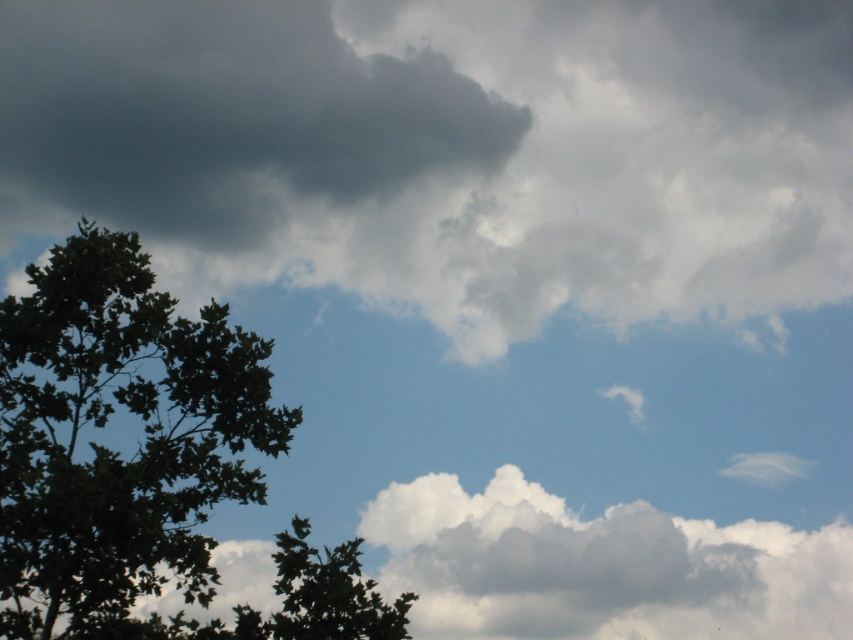
Is dark gray fluffy cloud at upper left closer to camera compared to white fluffy cloud at center?

No, dark gray fluffy cloud at upper left is behind white fluffy cloud at center.

Between dark gray fluffy cloud at upper left and white fluffy cloud at center, which one has less height?

With less height is white fluffy cloud at center.

Does point (621, 83) come farther from viewer compared to point (548, 525)?

Yes, point (621, 83) is behind point (548, 525).

Where is `dark gray fluffy cloud at upper left`? Image resolution: width=853 pixels, height=640 pixels. dark gray fluffy cloud at upper left is located at coordinates (448, 148).

I want to click on green leafy tree at left, so click(112, 449).

The width and height of the screenshot is (853, 640). What do you see at coordinates (112, 449) in the screenshot? I see `green leafy tree at left` at bounding box center [112, 449].

Identify the location of green leafy tree at left. This screenshot has width=853, height=640. pos(112,449).

Looking at this image, does dark gray fluffy cloud at upper left have a lesser height compared to green leafy tree at left?

No.

Is dark gray fluffy cloud at upper left taller than green leafy tree at left?

Yes.

Identify the location of dark gray fluffy cloud at upper left. The width and height of the screenshot is (853, 640). (448, 148).